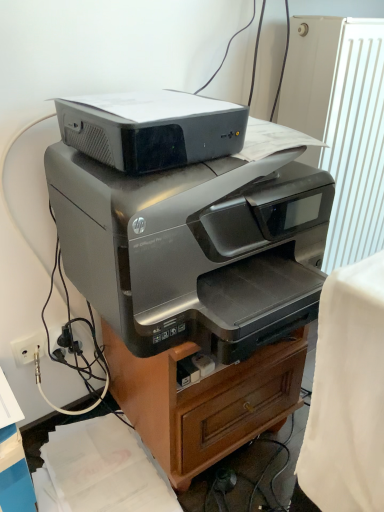
The image size is (384, 512). What do you see at coordinates (197, 244) in the screenshot?
I see `satin silver printer at center, which ranks as the 1th printer in bottom-to-top order` at bounding box center [197, 244].

In order to face satin silver printer at center, the second printer from the top, should I rotate leftwards or rightwards?

A 1.976 degree turn to the right will do.

This screenshot has width=384, height=512. What do you see at coordinates (28, 348) in the screenshot?
I see `white plastic electric outlet at lower left` at bounding box center [28, 348].

What do you see at coordinates (204, 401) in the screenshot? I see `satin silver printer at center` at bounding box center [204, 401].

Where is `satin silver printer at center, which ranks as the 1th printer in bottom-to-top order`? satin silver printer at center, which ranks as the 1th printer in bottom-to-top order is located at coordinates (197, 244).

From the image's perspective, is black plastic plug at lower left below white plastic electric outlet at lower left?

No, from the image's perspective, black plastic plug at lower left is not beneath white plastic electric outlet at lower left.

Which object is closer to the camera, black plastic plug at lower left or white plastic electric outlet at lower left?

black plastic plug at lower left is in front.

Is black plastic plug at lower left aimed at white plastic electric outlet at lower left?

No, black plastic plug at lower left is not aimed at white plastic electric outlet at lower left.

Is black plastic plug at lower left thinner than white plastic electric outlet at lower left?

No, black plastic plug at lower left is not thinner than white plastic electric outlet at lower left.

There is a white plastic electric outlet at lower left. Identify the location of the 1st printer above it (from a real-world perspective). The width and height of the screenshot is (384, 512). (197, 244).

Is white plastic electric outlet at lower left to the left of satin silver printer at center, the second printer from the top, from the viewer's perspective?

Yes.

Between white plastic electric outlet at lower left and satin silver printer at center, the second printer from the top, which one has more height?

satin silver printer at center, the second printer from the top, is taller.

Is white plastic electric outlet at lower left positioned with its back to satin silver printer at center, which ranks as the 1th printer in bottom-to-top order?

No, white plastic electric outlet at lower left is not facing away from satin silver printer at center, which ranks as the 1th printer in bottom-to-top order.

I want to click on the 1st printer below the white textured radiator at upper right (from the image's perspective), so click(x=151, y=129).

In the image, is white textured radiator at upper right positioned in front of or behind matte black printer at upper center, which appears as the second printer when ordered from the bottom?

white textured radiator at upper right is positioned farther from the viewer than matte black printer at upper center, which appears as the second printer when ordered from the bottom.

Is white textured radiator at upper right spatially inside matte black printer at upper center, which appears as the second printer when ordered from the bottom, or outside of it?

The correct answer is: outside.

Is white textured radiator at upper right beside matte black printer at upper center, arranged as the 1th printer when viewed from the top?

white textured radiator at upper right and matte black printer at upper center, arranged as the 1th printer when viewed from the top, are clearly separated.

Is black plastic plug at lower left aimed at satin silver printer at center?

No, black plastic plug at lower left does not turn towards satin silver printer at center.

The width and height of the screenshot is (384, 512). I want to click on plug that appears above the satin silver printer at center (from a real-world perspective), so click(x=69, y=340).

Considering the sizes of objects black plastic plug at lower left and satin silver printer at center in the image provided, who is wider, black plastic plug at lower left or satin silver printer at center?

satin silver printer at center.

From the image's perspective, who appears lower, black plastic plug at lower left or satin silver printer at center?

From the image's view, satin silver printer at center is below.

Which is more to the left, satin silver printer at center or matte black printer at upper center, which appears as the second printer when ordered from the bottom?

matte black printer at upper center, which appears as the second printer when ordered from the bottom, is more to the left.

Which of these two, satin silver printer at center or matte black printer at upper center, arranged as the 1th printer when viewed from the top, is smaller?

Smaller between the two is matte black printer at upper center, arranged as the 1th printer when viewed from the top.

Is satin silver printer at center next to matte black printer at upper center, which appears as the second printer when ordered from the bottom?

No, satin silver printer at center is not touching matte black printer at upper center, which appears as the second printer when ordered from the bottom.

In terms of width, does satin silver printer at center look wider or thinner when compared to satin silver printer at center, which ranks as the 1th printer in bottom-to-top order?

In the image, satin silver printer at center appears to be more narrow than satin silver printer at center, which ranks as the 1th printer in bottom-to-top order.

Do you think satin silver printer at center is within satin silver printer at center, the second printer from the top, or outside of it?

satin silver printer at center is not enclosed by satin silver printer at center, the second printer from the top.

Between satin silver printer at center and satin silver printer at center, which ranks as the 1th printer in bottom-to-top order, which one appears on the right side from the viewer's perspective?

From the viewer's perspective, satin silver printer at center appears more on the right side.

Is white textured radiator at upper right in front of or behind satin silver printer at center in the image?

white textured radiator at upper right is positioned farther from the viewer than satin silver printer at center.

Where is `furniture that appears on the left of white textured radiator at upper right`? The height and width of the screenshot is (512, 384). furniture that appears on the left of white textured radiator at upper right is located at coordinates (204, 401).

Is there a large distance between white textured radiator at upper right and satin silver printer at center?

No.

Is white textured radiator at upper right spatially inside satin silver printer at center, or outside of it?

white textured radiator at upper right is located beyond the bounds of satin silver printer at center.

Image resolution: width=384 pixels, height=512 pixels. What are the coordinates of `electric outlet below the black plastic plug at lower left (from a real-world perspective)` in the screenshot? It's located at (28, 348).

Which printer is the 2nd one when counting from the front of the white plastic electric outlet at lower left? Please provide its 2D coordinates.

[(197, 244)]

Which object lies further to the anchor point matte black printer at upper center, arranged as the 1th printer when viewed from the top, black plastic plug at lower left or satin silver printer at center?

Based on the image, black plastic plug at lower left appears to be further to matte black printer at upper center, arranged as the 1th printer when viewed from the top.

Which object lies nearer to the anchor point white textured radiator at upper right, satin silver printer at center or matte black printer at upper center, which appears as the second printer when ordered from the bottom?

matte black printer at upper center, which appears as the second printer when ordered from the bottom, is closer to white textured radiator at upper right.

Considering their positions, is black plastic plug at lower left positioned closer to white plastic electric outlet at lower left than satin silver printer at center, which ranks as the 1th printer in bottom-to-top order?

black plastic plug at lower left is positioned closer to the anchor white plastic electric outlet at lower left.

Estimate the real-world distances between objects in this image. Which object is further from satin silver printer at center, white textured radiator at upper right or satin silver printer at center, which ranks as the 1th printer in bottom-to-top order?

white textured radiator at upper right is further to satin silver printer at center.

When comparing their distances from satin silver printer at center, which ranks as the 1th printer in bottom-to-top order, does black plastic plug at lower left or matte black printer at upper center, which appears as the second printer when ordered from the bottom, seem further?

black plastic plug at lower left is further to satin silver printer at center, which ranks as the 1th printer in bottom-to-top order.

Looking at this image, from the image, which object appears to be nearer to satin silver printer at center, black plastic plug at lower left or matte black printer at upper center, which appears as the second printer when ordered from the bottom?

black plastic plug at lower left lies closer to satin silver printer at center than the other object.

Which object lies nearer to the anchor point satin silver printer at center, satin silver printer at center, which ranks as the 1th printer in bottom-to-top order, or black plastic plug at lower left?

satin silver printer at center, which ranks as the 1th printer in bottom-to-top order, is positioned closer to the anchor satin silver printer at center.

Looking at the image, which one is located closer to white plastic electric outlet at lower left, white textured radiator at upper right or matte black printer at upper center, arranged as the 1th printer when viewed from the top?

matte black printer at upper center, arranged as the 1th printer when viewed from the top, is closer to white plastic electric outlet at lower left.

Locate an element on the screen. printer between satin silver printer at center, the second printer from the top, and black plastic plug at lower left from front to back is located at coordinates (151, 129).

The height and width of the screenshot is (512, 384). I want to click on plug positioned between matte black printer at upper center, arranged as the 1th printer when viewed from the top, and white plastic electric outlet at lower left from near to far, so click(69, 340).

At what (x,y) coordinates should I click in order to perform the action: click on plug situated between white plastic electric outlet at lower left and white textured radiator at upper right from left to right. Please return your answer as a coordinate pair (x, y). Looking at the image, I should click on (69, 340).

Find the location of `furniture located between white plastic electric outlet at lower left and white textured radiator at upper right in the left-right direction`. furniture located between white plastic electric outlet at lower left and white textured radiator at upper right in the left-right direction is located at coordinates (204, 401).